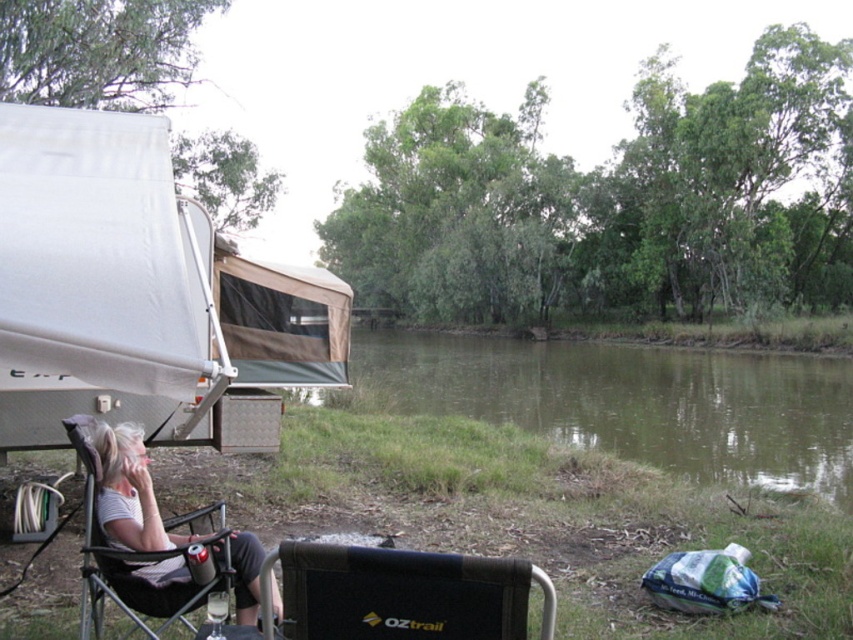
Question: Is green grassy riverbank at center above black fabric chair at lower center?

Choices:
 (A) yes
 (B) no

Answer: (A)

Question: Which object appears closest to the camera in this image?

Choices:
 (A) green grassy riverbank at center
 (B) black fabric chair at lower center
 (C) gray fabric chair at lower left

Answer: (B)

Question: Considering the relative positions of black fabric chair at lower center and gray fabric chair at lower left in the image provided, where is black fabric chair at lower center located with respect to gray fabric chair at lower left?

Choices:
 (A) left
 (B) right

Answer: (B)

Question: Is black fabric chair at lower center thinner than gray fabric chair at lower left?

Choices:
 (A) yes
 (B) no

Answer: (A)

Question: Among these objects, which one is farthest from the camera?

Choices:
 (A) black fabric chair at lower center
 (B) green grassy riverbank at center
 (C) gray fabric chair at lower left

Answer: (B)

Question: Which object is positioned closest to the green grassy riverbank at center?

Choices:
 (A) gray fabric chair at lower left
 (B) black fabric chair at lower center

Answer: (A)